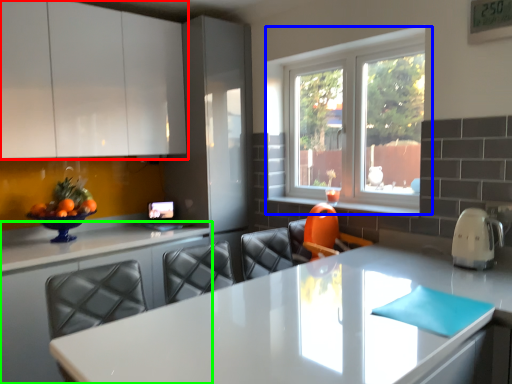
Question: Which is farther away from cabinetry (highlighted by a red box)? window (highlighted by a blue box) or countertop (highlighted by a green box)?

Choices:
 (A) window
 (B) countertop

Answer: (A)